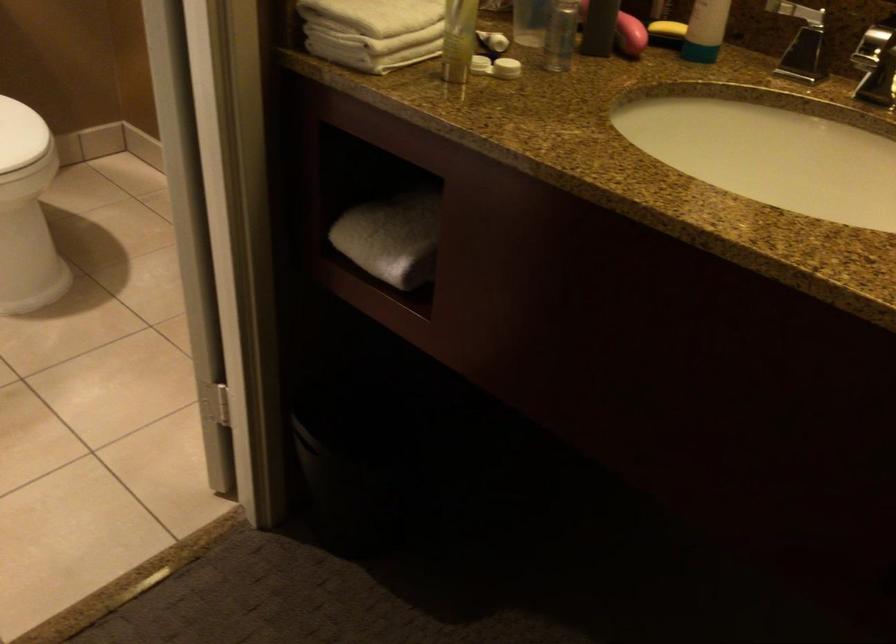
Find where to lift the white toilet lid. Please return your answer as a coordinate pair (x, y).

(20, 135)